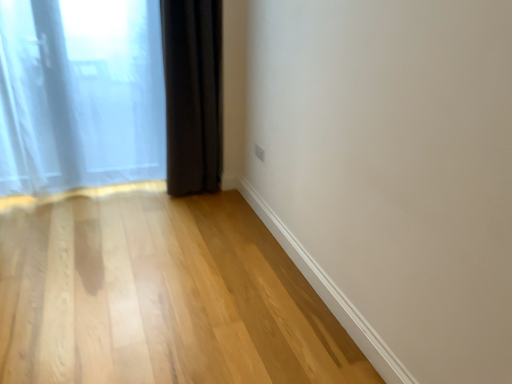
You are a GUI agent. You are given a task and a screenshot of the screen. Output one action in this format:
    pyautogui.click(x=<x>, y=<y>)
    Task: Click on the light wood floor at lower left
    
    Given the screenshot: What is the action you would take?
    pyautogui.click(x=159, y=294)

I want to click on dark matte curtain at lower left, acting as the 2th curtain starting from the left, so click(193, 94).

At what (x,y) coordinates should I click in order to perform the action: click on translucent fabric curtain at left, marked as the 1th curtain in a left-to-right arrangement. Please return your answer as a coordinate pair (x, y). Looking at the image, I should click on (80, 94).

Which is behind, point (73, 147) or point (246, 320)?

The point (73, 147) is farther.

Is translucent fabric curtain at left, marked as the 1th curtain in a left-to-right arrangement, to the right of light wood floor at lower left from the viewer's perspective?

Incorrect, translucent fabric curtain at left, marked as the 1th curtain in a left-to-right arrangement, is not on the right side of light wood floor at lower left.

Is translucent fabric curtain at left, marked as the 1th curtain in a left-to-right arrangement, turned away from light wood floor at lower left?

translucent fabric curtain at left, marked as the 1th curtain in a left-to-right arrangement, does not have its back to light wood floor at lower left.

In the scene shown: From the image's perspective, is translucent fabric curtain at left, marked as the 1th curtain in a left-to-right arrangement, under light wood floor at lower left?

Incorrect, from the image's perspective, translucent fabric curtain at left, marked as the 1th curtain in a left-to-right arrangement, is higher than light wood floor at lower left.

Is point (210, 1) closer or farther from the camera than point (70, 56)?

Point (210, 1) is closer to the camera than point (70, 56).

Locate an element on the screen. curtain that appears below the dark matte curtain at lower left, acting as the 2th curtain starting from the left (from the image's perspective) is located at coordinates (80, 94).

From the image's perspective, is dark matte curtain at lower left, acting as the 2th curtain starting from the left, above translucent fabric curtain at left, marked as the 1th curtain in a left-to-right arrangement?

Yes.

From the image's perspective, between translucent fabric curtain at left, placed as the second curtain when sorted from right to left, and dark matte curtain at lower left, acting as the 2th curtain starting from the left, who is located below?

translucent fabric curtain at left, placed as the second curtain when sorted from right to left, is shown below in the image.

Is translucent fabric curtain at left, marked as the 1th curtain in a left-to-right arrangement, closer to the viewer compared to dark matte curtain at lower left, acting as the 2th curtain starting from the left?

Yes.

From the picture: From a real-world perspective, is translucent fabric curtain at left, placed as the second curtain when sorted from right to left, beneath dark matte curtain at lower left, which ranks as the first curtain in right-to-left order?

Indeed, from a real-world perspective, translucent fabric curtain at left, placed as the second curtain when sorted from right to left, is positioned beneath dark matte curtain at lower left, which ranks as the first curtain in right-to-left order.

Consider the image. Is translucent fabric curtain at left, placed as the second curtain when sorted from right to left, far from dark matte curtain at lower left, which ranks as the first curtain in right-to-left order?

translucent fabric curtain at left, placed as the second curtain when sorted from right to left, is near dark matte curtain at lower left, which ranks as the first curtain in right-to-left order, not far away.

Which curtain is the 2nd one when counting from the back of the light wood floor at lower left? Please provide its 2D coordinates.

[(193, 94)]

From the image's perspective, which is below, dark matte curtain at lower left, which ranks as the first curtain in right-to-left order, or light wood floor at lower left?

light wood floor at lower left is shown below in the image.

Which is closer to the camera, (208,72) or (193,332)?

Point (208,72) is positioned farther from the camera compared to point (193,332).

Choose the correct answer: Is dark matte curtain at lower left, acting as the 2th curtain starting from the left, inside light wood floor at lower left or outside it?

dark matte curtain at lower left, acting as the 2th curtain starting from the left, is outside light wood floor at lower left.

Is dark matte curtain at lower left, which ranks as the first curtain in right-to-left order, located within light wood floor at lower left?

Actually, dark matte curtain at lower left, which ranks as the first curtain in right-to-left order, is outside light wood floor at lower left.

Where is `corridor below the dark matte curtain at lower left, acting as the 2th curtain starting from the left (from a real-world perspective)`? corridor below the dark matte curtain at lower left, acting as the 2th curtain starting from the left (from a real-world perspective) is located at coordinates (159, 294).

From a real-world perspective, which is physically above, light wood floor at lower left or dark matte curtain at lower left, which ranks as the first curtain in right-to-left order?

dark matte curtain at lower left, which ranks as the first curtain in right-to-left order, from a real-world perspective.

Is light wood floor at lower left facing away from dark matte curtain at lower left, acting as the 2th curtain starting from the left?

light wood floor at lower left does not have its back to dark matte curtain at lower left, acting as the 2th curtain starting from the left.

Identify the location of corridor directly beneath the translucent fabric curtain at left, placed as the second curtain when sorted from right to left (from a real-world perspective). The height and width of the screenshot is (384, 512). (159, 294).

Does light wood floor at lower left have a greater width compared to translucent fabric curtain at left, placed as the second curtain when sorted from right to left?

Correct, the width of light wood floor at lower left exceeds that of translucent fabric curtain at left, placed as the second curtain when sorted from right to left.

Considering the relative sizes of light wood floor at lower left and translucent fabric curtain at left, marked as the 1th curtain in a left-to-right arrangement, in the image provided, is light wood floor at lower left bigger than translucent fabric curtain at left, marked as the 1th curtain in a left-to-right arrangement,?

No.

From a real-world perspective, is light wood floor at lower left on translucent fabric curtain at left, placed as the second curtain when sorted from right to left?

→ Actually, light wood floor at lower left is physically below translucent fabric curtain at left, placed as the second curtain when sorted from right to left, in the real world.

Find the location of a particular element. curtain lying on the left of light wood floor at lower left is located at coordinates (80, 94).

This screenshot has width=512, height=384. I want to click on curtain located behind the translucent fabric curtain at left, marked as the 1th curtain in a left-to-right arrangement, so click(193, 94).

When comparing their distances from translucent fabric curtain at left, marked as the 1th curtain in a left-to-right arrangement, does dark matte curtain at lower left, acting as the 2th curtain starting from the left, or light wood floor at lower left seem closer?

Among the two, dark matte curtain at lower left, acting as the 2th curtain starting from the left, is located nearer to translucent fabric curtain at left, marked as the 1th curtain in a left-to-right arrangement.

Based on their spatial positions, is light wood floor at lower left or translucent fabric curtain at left, placed as the second curtain when sorted from right to left, further from dark matte curtain at lower left, which ranks as the first curtain in right-to-left order?

The object further to dark matte curtain at lower left, which ranks as the first curtain in right-to-left order, is light wood floor at lower left.

Which object lies further to the anchor point light wood floor at lower left, dark matte curtain at lower left, which ranks as the first curtain in right-to-left order, or translucent fabric curtain at left, marked as the 1th curtain in a left-to-right arrangement?

dark matte curtain at lower left, which ranks as the first curtain in right-to-left order, lies further to light wood floor at lower left than the other object.

From the image, which object appears to be farther from translucent fabric curtain at left, placed as the second curtain when sorted from right to left, light wood floor at lower left or dark matte curtain at lower left, which ranks as the first curtain in right-to-left order?

Among the two, light wood floor at lower left is located further to translucent fabric curtain at left, placed as the second curtain when sorted from right to left.

Which object lies nearer to the anchor point dark matte curtain at lower left, which ranks as the first curtain in right-to-left order, translucent fabric curtain at left, marked as the 1th curtain in a left-to-right arrangement, or light wood floor at lower left?

translucent fabric curtain at left, marked as the 1th curtain in a left-to-right arrangement.

Which object lies further to the anchor point light wood floor at lower left, translucent fabric curtain at left, marked as the 1th curtain in a left-to-right arrangement, or dark matte curtain at lower left, acting as the 2th curtain starting from the left?

Among the two, dark matte curtain at lower left, acting as the 2th curtain starting from the left, is located further to light wood floor at lower left.

This screenshot has width=512, height=384. Identify the location of curtain located between light wood floor at lower left and dark matte curtain at lower left, which ranks as the first curtain in right-to-left order, in the depth direction. (80, 94).